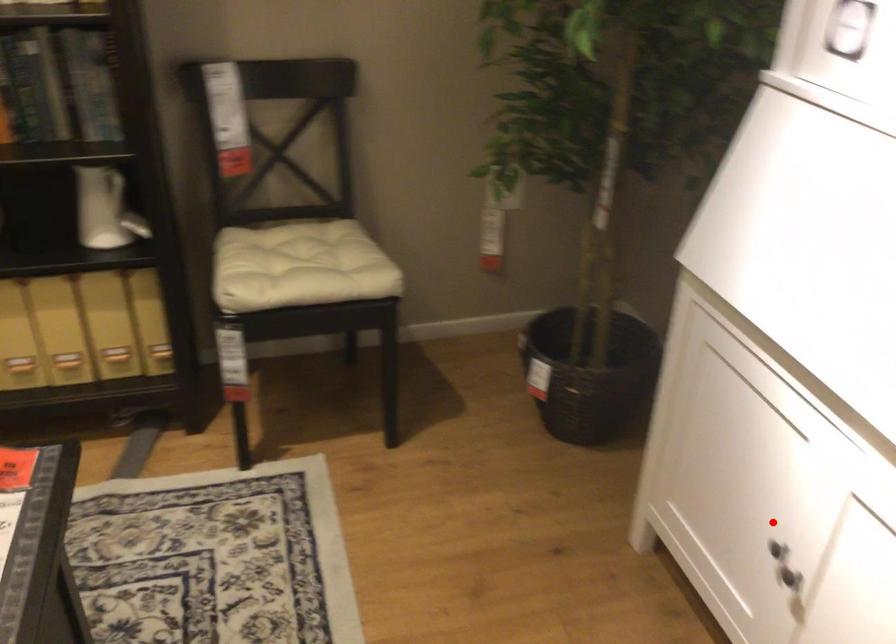
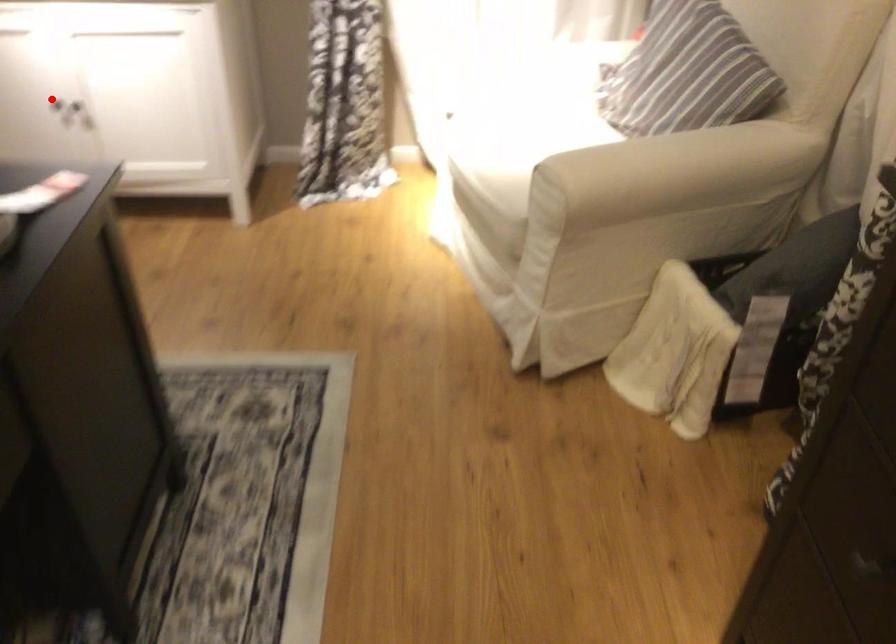
I am providing you with two images of the same scene from different viewpoints. A red point is marked on the first image and another point is marked on the second image. Do the highlighted points in image1 and image2 indicate the same real-world spot?

Yes